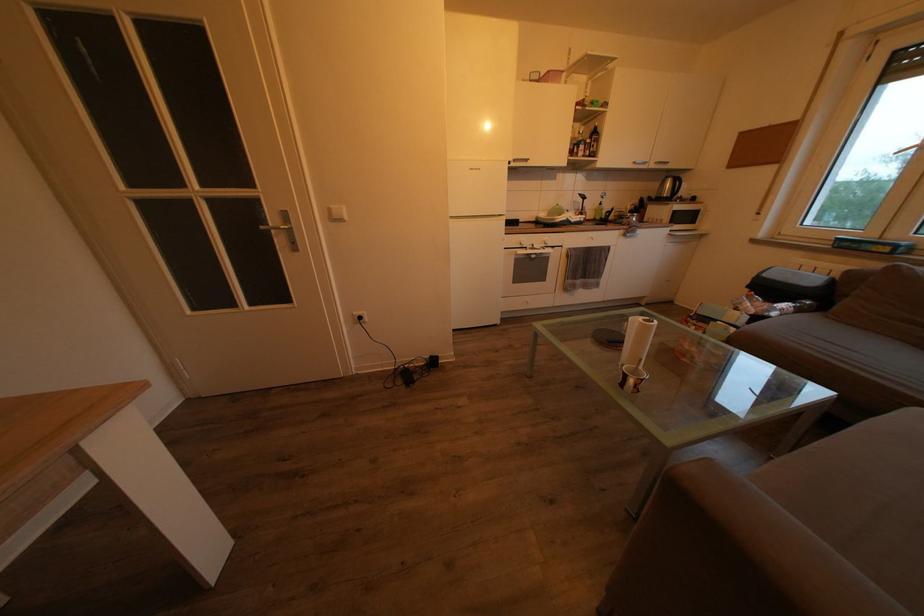
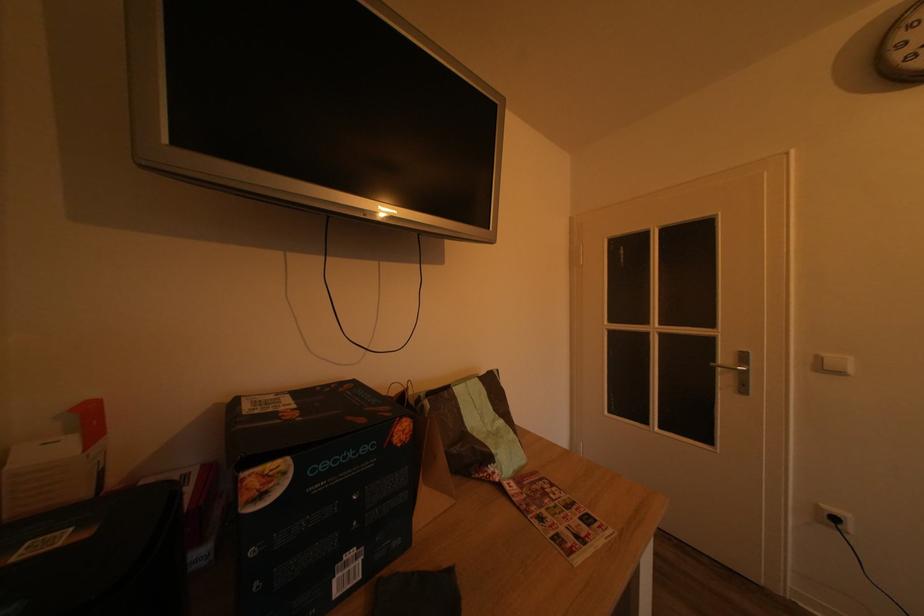
Question: The images are taken continuously from a first-person perspective. In which direction is your viewpoint rotating?

Choices:
 (A) Left
 (B) Right
 (C) Up
 (D) Down

Answer: (A)